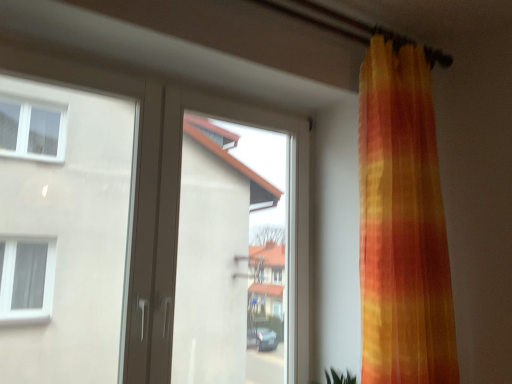
This screenshot has height=384, width=512. I want to click on transparent glass window at center, so click(x=237, y=245).

In order to face transparent glass window at center, should I rotate leftwards or rightwards?

Turn left approximately 2.009 degrees to face it.

The height and width of the screenshot is (384, 512). Describe the element at coordinates (237, 245) in the screenshot. I see `transparent glass window at center` at that location.

What do you see at coordinates (149, 239) in the screenshot? I see `matte brown door at left` at bounding box center [149, 239].

Locate an element on the screen. This screenshot has width=512, height=384. matte brown door at left is located at coordinates (149, 239).

The image size is (512, 384). Identify the location of transparent glass window at center. (237, 245).

Which is more to the right, matte brown door at left or transparent glass window at center?

transparent glass window at center is more to the right.

Between matte brown door at left and transparent glass window at center, which one is positioned in front?

matte brown door at left is closer to the camera.

Considering the positions of points (199, 156) and (276, 306), is point (199, 156) farther from camera compared to point (276, 306)?

That is True.

From the image's perspective, does matte brown door at left appear higher than transparent glass window at center?

Yes, from the image's perspective, matte brown door at left is over transparent glass window at center.

From a real-world perspective, is matte brown door at left above or below transparent glass window at center?

matte brown door at left is above transparent glass window at center.

Is matte brown door at left thinner than transparent glass window at center?

Indeed, matte brown door at left has a lesser width compared to transparent glass window at center.

Which of these two, matte brown door at left or transparent glass window at center, stands shorter?

transparent glass window at center is shorter.

Who is bigger, matte brown door at left or transparent glass window at center?

With larger size is transparent glass window at center.

Based on the photo, can we say matte brown door at left lies outside transparent glass window at center?

No, matte brown door at left is inside transparent glass window at center's boundary.

Is matte brown door at left placed right next to transparent glass window at center?

No, matte brown door at left is not touching transparent glass window at center.

Is matte brown door at left aimed at transparent glass window at center?

Yes, matte brown door at left faces towards transparent glass window at center.

Where is `door that is in front of the transparent glass window at center`? door that is in front of the transparent glass window at center is located at coordinates (149, 239).

In the image, is transparent glass window at center on the left side or the right side of matte brown door at left?

From the image, it's evident that transparent glass window at center is to the right of matte brown door at left.

Considering the positions of objects transparent glass window at center and matte brown door at left in the image provided, who is in front, transparent glass window at center or matte brown door at left?

matte brown door at left is closer to the camera.

Is point (185, 254) less distant than point (86, 359)?

Yes, point (185, 254) is closer to viewer.

From the image's perspective, which one is positioned lower, transparent glass window at center or matte brown door at left?

transparent glass window at center.

From a real-world perspective, between transparent glass window at center and matte brown door at left, who is vertically lower?

transparent glass window at center.

Looking at this image, between transparent glass window at center and matte brown door at left, which one has smaller width?

matte brown door at left.

In the scene shown: In terms of height, does transparent glass window at center look taller or shorter compared to matte brown door at left?

Considering their sizes, transparent glass window at center has less height than matte brown door at left.

Is transparent glass window at center smaller than matte brown door at left?

No, transparent glass window at center is not smaller than matte brown door at left.

Is transparent glass window at center not within matte brown door at left?

Indeed, transparent glass window at center is completely outside matte brown door at left.

Is transparent glass window at center positioned far away from matte brown door at left?

transparent glass window at center is far away from matte brown door at left.

Is transparent glass window at center facing away from matte brown door at left?

Yes, transparent glass window at center is positioned with its back facing matte brown door at left.

Find the location of a particular element. The width and height of the screenshot is (512, 384). window screen on the right of the matte brown door at left is located at coordinates (237, 245).

This screenshot has height=384, width=512. In order to click on door positioned vertically above the transparent glass window at center (from a real-world perspective) in this screenshot , I will do `click(149, 239)`.

The width and height of the screenshot is (512, 384). In order to click on window screen that is under the matte brown door at left (from a real-world perspective) in this screenshot , I will do `click(237, 245)`.